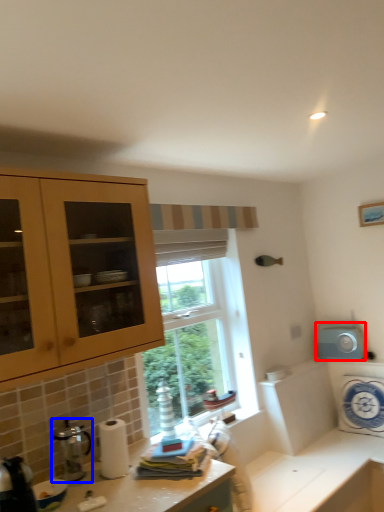
Question: Which of the following is the farthest to the observer, appliance (highlighted by a red box) or coffee machine (highlighted by a blue box)?

Choices:
 (A) appliance
 (B) coffee machine

Answer: (A)